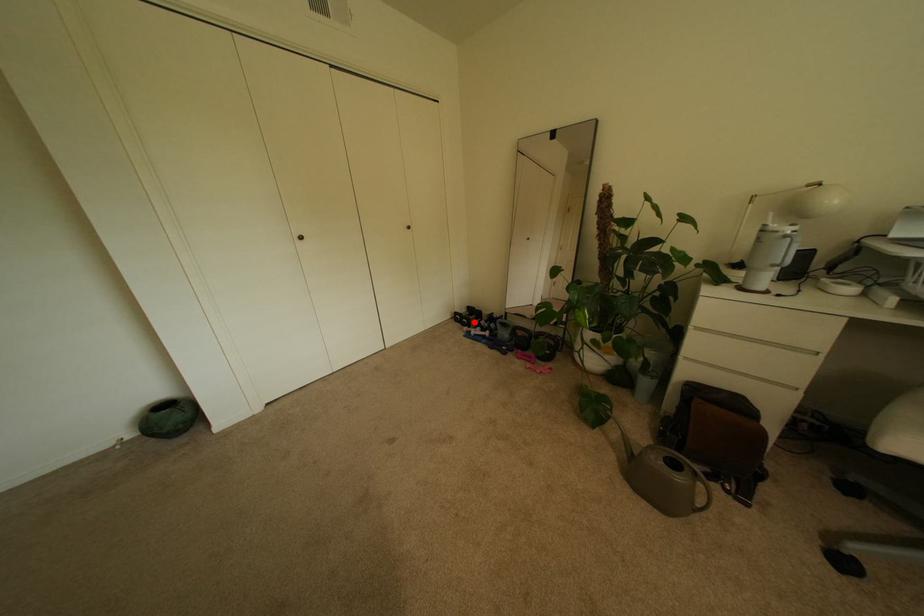
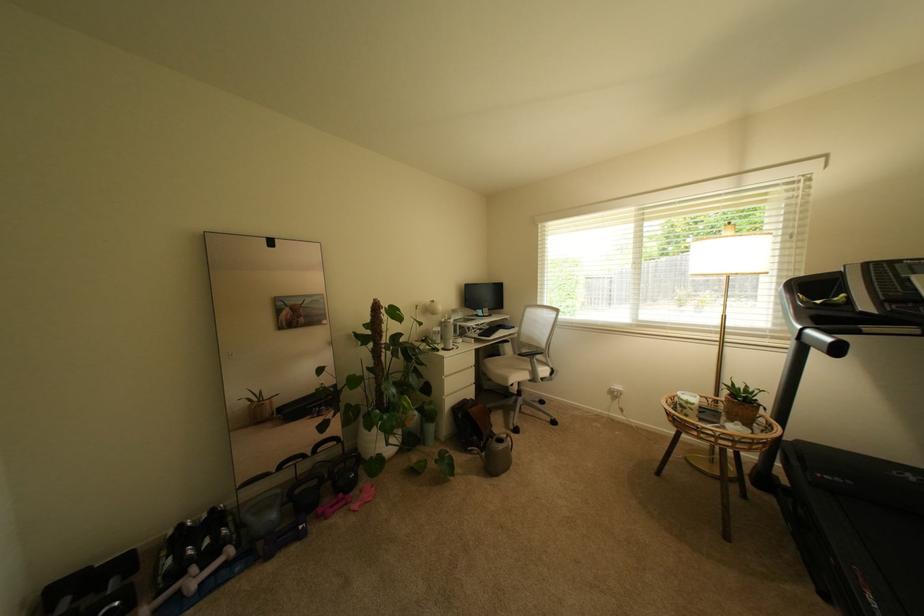
The point at the highlighted location is marked in the first image. Where is the corresponding point in the second image?

(126, 604)